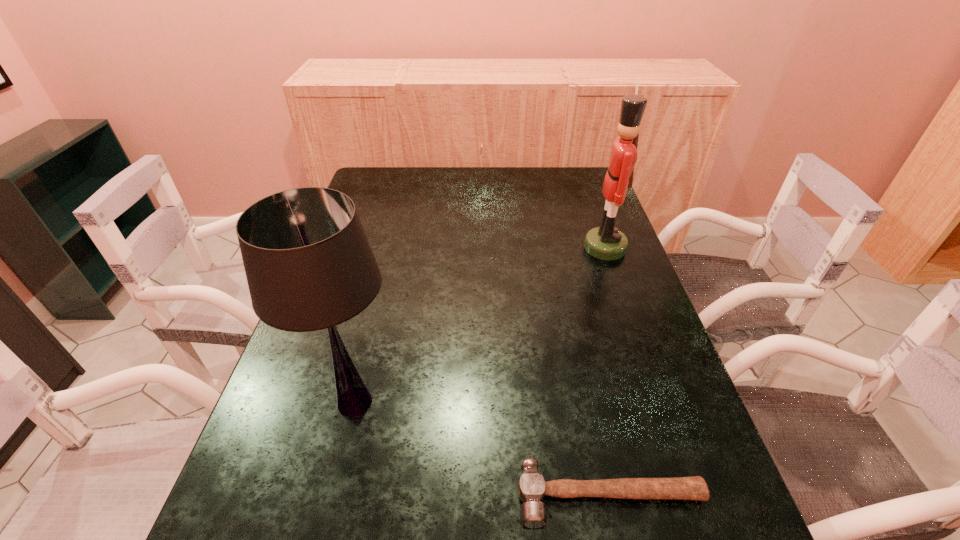
Find the location of `vacant area between the hammer and the lampshade`. vacant area between the hammer and the lampshade is located at coordinates (483, 449).

What are the coordinates of `free area in between the nearest object and the nutcracker` in the screenshot? It's located at (608, 372).

The width and height of the screenshot is (960, 540). In order to click on free area in between the nearest object and the lampshade in this screenshot , I will do `click(483, 449)`.

The width and height of the screenshot is (960, 540). In order to click on empty location between the hammer and the second nearest object in this screenshot , I will do pyautogui.click(x=483, y=449).

Image resolution: width=960 pixels, height=540 pixels. In order to click on free space between the leftmost object and the shortest object in this screenshot , I will do `click(483, 449)`.

Identify the location of free space between the shortest object and the lampshade. This screenshot has height=540, width=960. (483, 449).

The width and height of the screenshot is (960, 540). Identify the location of object that is the second closest to the nutcracker. (532, 488).

This screenshot has height=540, width=960. Find the location of `object that is the second closest to the second farthest object`. object that is the second closest to the second farthest object is located at coordinates (606, 242).

This screenshot has width=960, height=540. What are the coordinates of `free region that satisfies the following two spatial constraints: 1. on the front-facing side of the farthest object; 2. on the striking face of the nearest object` in the screenshot? It's located at (691, 495).

The height and width of the screenshot is (540, 960). Find the location of `free space that satisfies the following two spatial constraints: 1. on the front-facing side of the nutcracker; 2. on the front-facing side of the lampshade`. free space that satisfies the following two spatial constraints: 1. on the front-facing side of the nutcracker; 2. on the front-facing side of the lampshade is located at coordinates (659, 402).